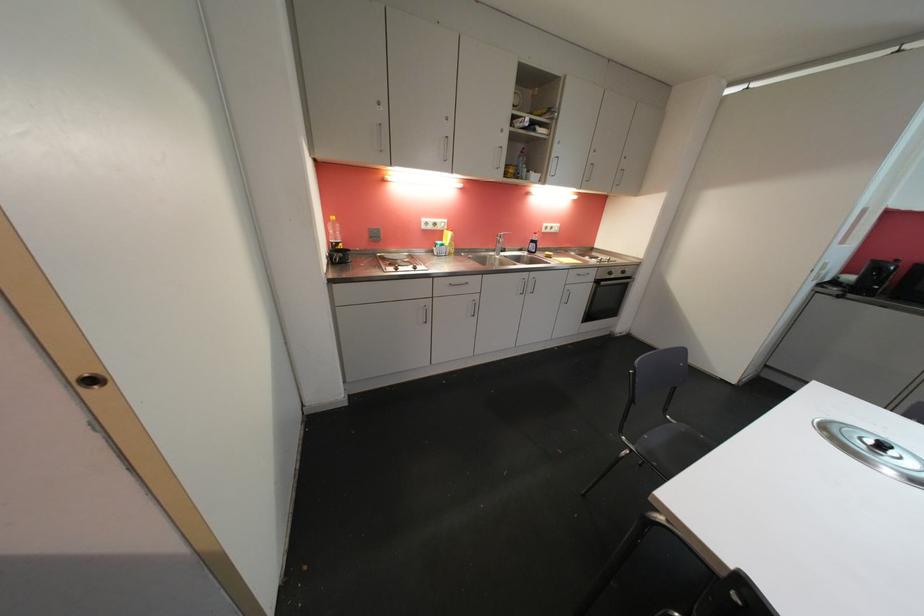
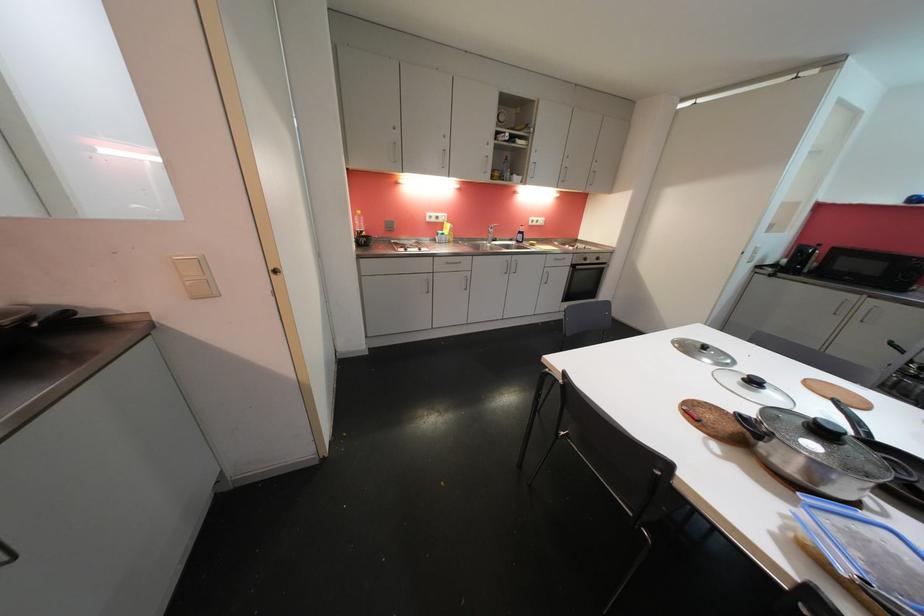
Locate, in the second image, the point that corresponds to point (332, 222) in the first image.

(359, 216)